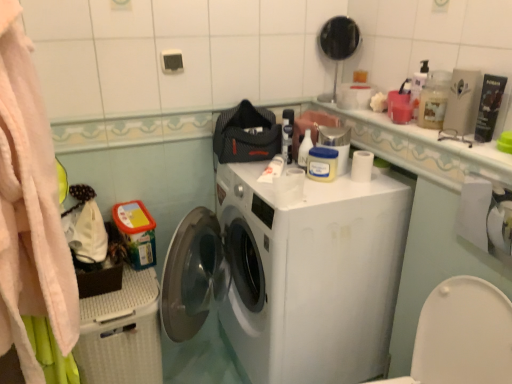
Find the location of `vacant space positioned to the left of white glossy bottle at upper center, positioned as the 1th cleaning product in left-to-right order`. vacant space positioned to the left of white glossy bottle at upper center, positioned as the 1th cleaning product in left-to-right order is located at coordinates (263, 170).